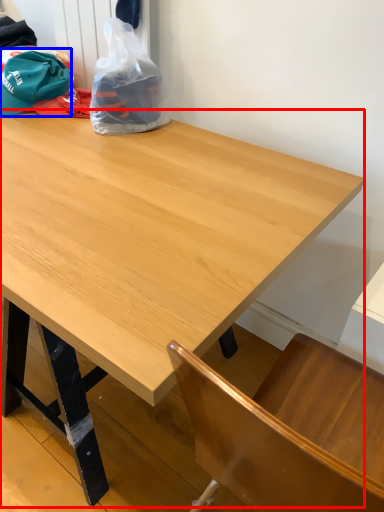
Question: Which object is further to the camera taking this photo, table (highlighted by a red box) or baseball hat (highlighted by a blue box)?

Choices:
 (A) table
 (B) baseball hat

Answer: (B)